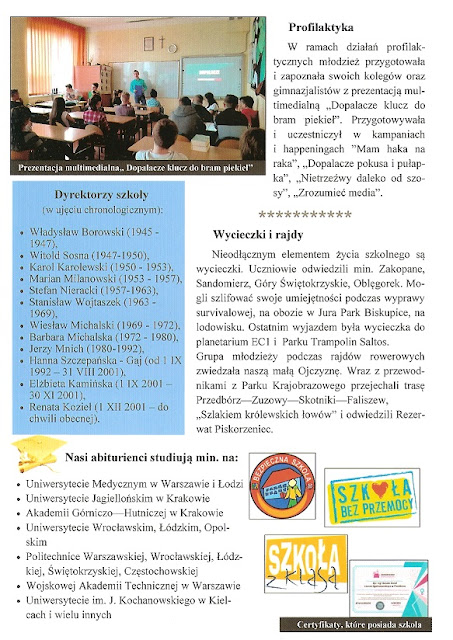
Locate an element on the screen. This screenshot has height=640, width=453. whiteboard is located at coordinates (164, 86).